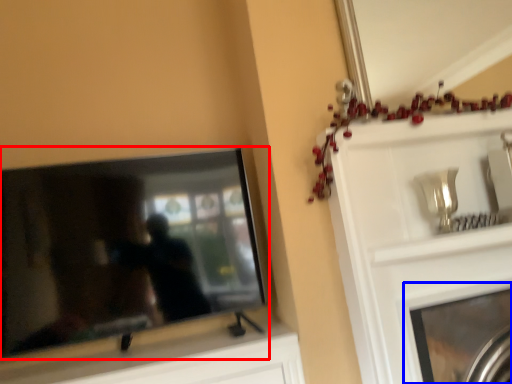
Question: Which point is closer to the camera, television (highlighted by a red box) or fireplace (highlighted by a blue box)?

Choices:
 (A) television
 (B) fireplace

Answer: (A)